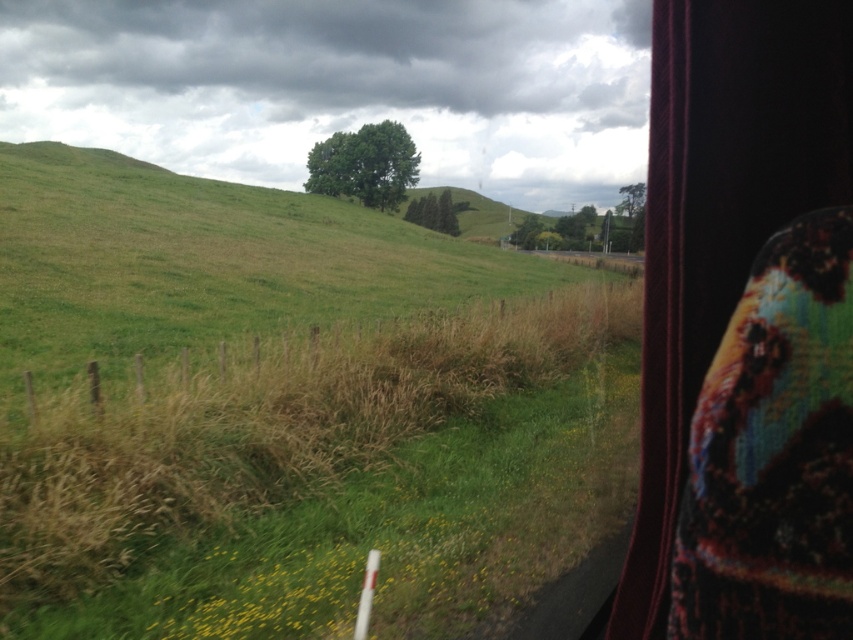
Question: Is green grassy hillside at center thinner than green leafy tree at upper center?

Choices:
 (A) yes
 (B) no

Answer: (B)

Question: Which point is farther from the camera taking this photo?

Choices:
 (A) (625, 196)
 (B) (657, 355)
 (C) (354, 140)
 (D) (436, 220)

Answer: (A)

Question: Considering the real-world distances, which object is farthest from the green leafy tree at upper center?

Choices:
 (A) green grassy at center
 (B) green matte tree at center
 (C) green leafy tree at center

Answer: (A)

Question: Considering the real-world distances, which object is farthest from the green leafy tree at upper center?

Choices:
 (A) green grassy at center
 (B) green matte tree at center
 (C) velvet dark curtain at right
 (D) green grassy hillside at center

Answer: (C)

Question: Is velvet dark curtain at right in front of green matte tree at center?

Choices:
 (A) yes
 (B) no

Answer: (A)

Question: Is velvet dark curtain at right positioned at the back of green leafy tree at upper center?

Choices:
 (A) yes
 (B) no

Answer: (B)